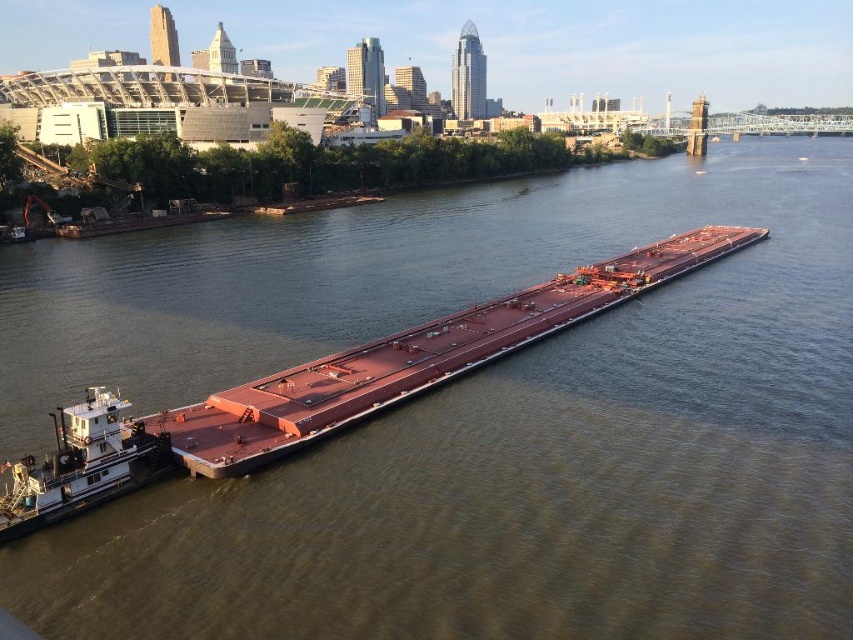
Question: Can you confirm if smooth reddish-brown barge at center is wider than white painted steel tugboat at lower left?

Choices:
 (A) yes
 (B) no

Answer: (A)

Question: Observing the image, what is the correct spatial positioning of smooth reddish-brown barge at center in reference to white painted steel tugboat at lower left?

Choices:
 (A) right
 (B) left

Answer: (A)

Question: Among these objects, which one is nearest to the camera?

Choices:
 (A) smooth reddish-brown barge at center
 (B) white painted steel tugboat at lower left

Answer: (B)

Question: Which point is closer to the camera?

Choices:
 (A) white painted steel tugboat at lower left
 (B) smooth reddish-brown barge at center

Answer: (A)

Question: Can you confirm if smooth reddish-brown barge at center is positioned above white painted steel tugboat at lower left?

Choices:
 (A) no
 (B) yes

Answer: (B)

Question: Which point is closer to the camera?

Choices:
 (A) (x=670, y=264)
 (B) (x=33, y=493)

Answer: (B)